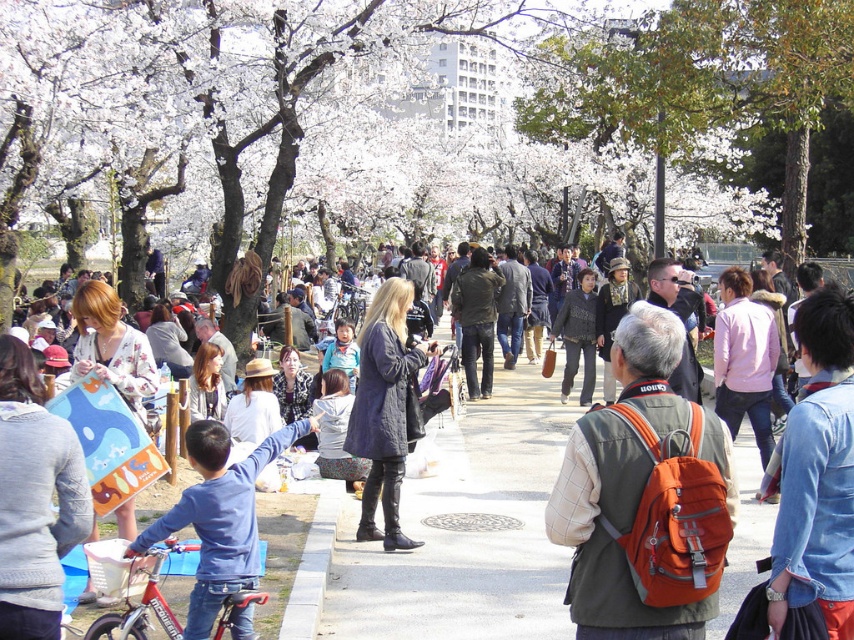
Question: Which point is farther to the camera?

Choices:
 (A) denim shirt at center right
 (B) knitted gray sweater at lower left
 (C) dark brown leather jacket at center
 (D) white blossoms at upper center

Answer: (C)

Question: Among these points, which one is farthest from the camera?

Choices:
 (A) (654, 372)
 (B) (835, 294)
 (C) (474, 358)

Answer: (C)

Question: Which point is closer to the camera?

Choices:
 (A) (363, 570)
 (B) (389, 502)

Answer: (A)

Question: Is denim jacket at center further to the viewer compared to orange fabric backpack at center?

Choices:
 (A) yes
 (B) no

Answer: (A)

Question: Does orange fabric backpack at center appear on the left side of pink fabric jacket at center-right?

Choices:
 (A) yes
 (B) no

Answer: (A)

Question: Can you confirm if denim jacket at center is positioned below knitted gray sweater at lower left?

Choices:
 (A) no
 (B) yes

Answer: (B)